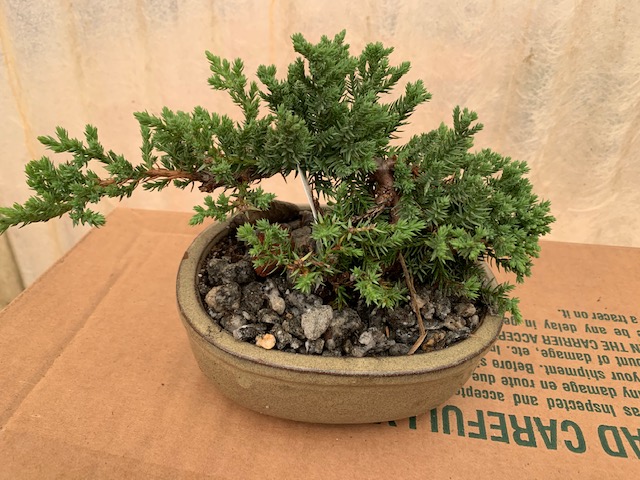
This screenshot has height=480, width=640. I want to click on plant, so click(x=473, y=228).